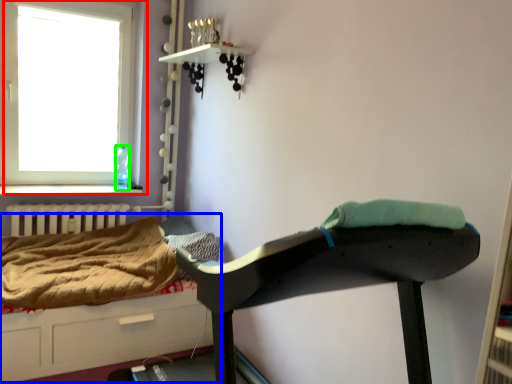
Question: Based on their relative distances, which object is farther from window (highlighted by a red box)? Choose from hospital bed (highlighted by a blue box) and bottle (highlighted by a green box).

Choices:
 (A) hospital bed
 (B) bottle

Answer: (A)